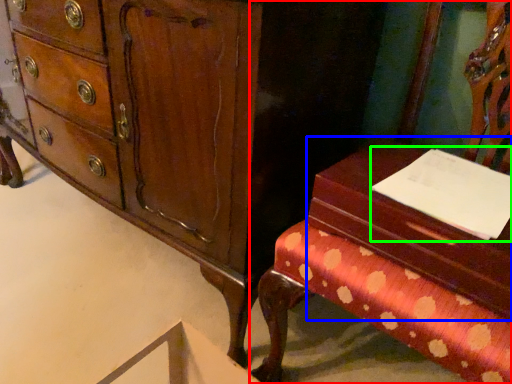
Question: Which is nearer to the furniture (highlighted by a red box)? vanity (highlighted by a blue box) or notepad (highlighted by a green box).

Choices:
 (A) vanity
 (B) notepad

Answer: (A)